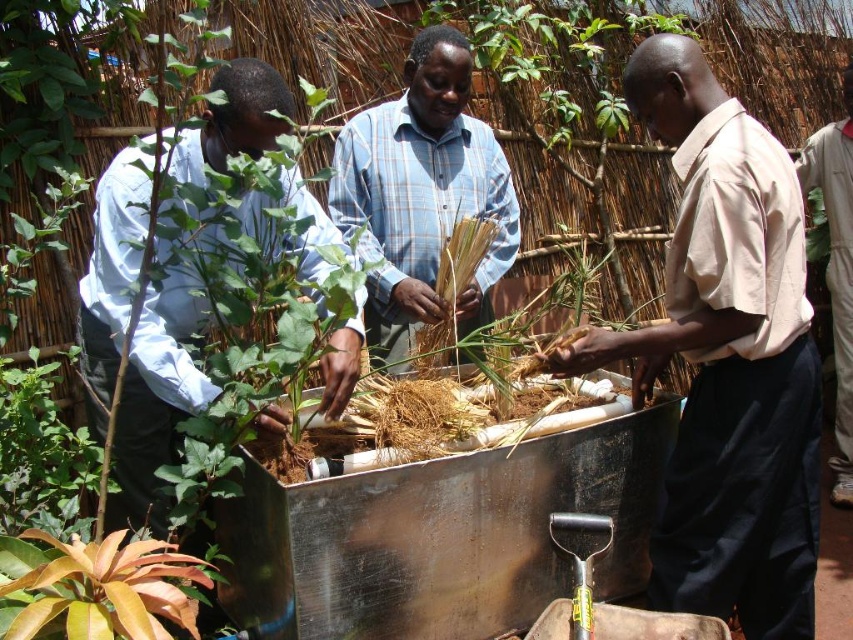
Does light blue shirt at left have a larger size compared to leathery brown leaf at lower left?

Correct, light blue shirt at left is larger in size than leathery brown leaf at lower left.

Is light blue shirt at left above leathery brown leaf at lower left?

Yes.

This screenshot has height=640, width=853. Describe the element at coordinates (155, 400) in the screenshot. I see `light blue shirt at left` at that location.

The image size is (853, 640). Identify the location of light blue shirt at left. (155, 400).

Is beige cotton shirt at center positioned in front of leathery brown leaf at lower left?

No, it is behind leathery brown leaf at lower left.

You are a GUI agent. You are given a task and a screenshot of the screen. Output one action in this format:
    pyautogui.click(x=<x>, y=<y>)
    Task: Click on the beige cotton shirt at center
    This screenshot has width=853, height=640.
    Given the screenshot: What is the action you would take?
    pyautogui.click(x=726, y=358)

At what (x,y) coordinates should I click in order to perform the action: click on beige cotton shirt at center. Please return your answer as a coordinate pair (x, y). This screenshot has width=853, height=640. Looking at the image, I should click on (726, 358).

Which is more to the right, beige cotton shirt at center or light blue shirt at left?

beige cotton shirt at center

Between beige cotton shirt at center and light blue shirt at left, which one is positioned higher?

Positioned higher is light blue shirt at left.

The width and height of the screenshot is (853, 640). Find the location of `beige cotton shirt at center`. beige cotton shirt at center is located at coordinates (726, 358).

Where is `beige cotton shirt at center`? This screenshot has height=640, width=853. beige cotton shirt at center is located at coordinates (726, 358).